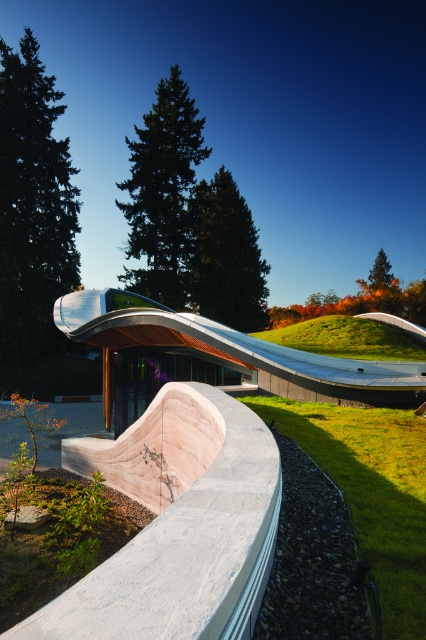
Is white concrete skate park at center to the right of green grass at lower right from the viewer's perspective?

Correct, you'll find white concrete skate park at center to the right of green grass at lower right.

Can you confirm if white concrete skate park at center is smaller than green grass at lower right?

No, white concrete skate park at center is not smaller than green grass at lower right.

Measure the distance between white concrete skate park at center and camera.

white concrete skate park at center is 3.65 feet away from camera.

At what (x,y) coordinates should I click in order to perform the action: click on white concrete skate park at center. Please return your answer as a coordinate pair (x, y). The image size is (426, 640). Looking at the image, I should click on (172, 522).

Between white polished concrete bench at center and silver metallic slide at center, which one is positioned higher?

silver metallic slide at center is higher up.

Does white polished concrete bench at center appear on the left side of silver metallic slide at center?

Correct, you'll find white polished concrete bench at center to the left of silver metallic slide at center.

Where is `white polished concrete bench at center`? The width and height of the screenshot is (426, 640). white polished concrete bench at center is located at coordinates (176, 524).

The image size is (426, 640). What are the coordinates of `white polished concrete bench at center` in the screenshot? It's located at (176, 524).

From the picture: Is white concrete skate park at center smaller than green grass at upper center?

No.

Between white concrete skate park at center and green grass at upper center, which one is positioned higher?

green grass at upper center

Who is more forward, (100,317) or (406,339)?

Point (406,339)

Where is `white concrete skate park at center`? The height and width of the screenshot is (640, 426). white concrete skate park at center is located at coordinates (172, 522).